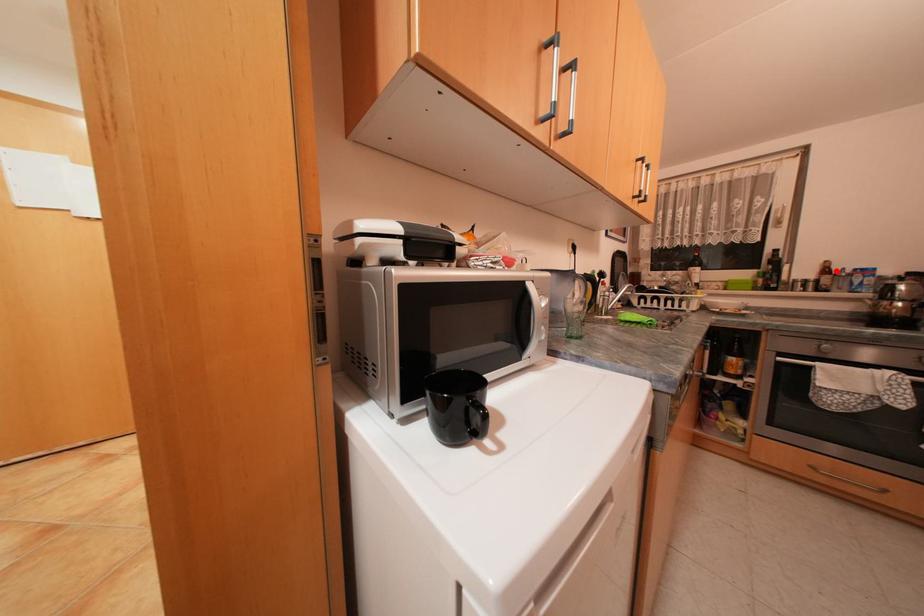
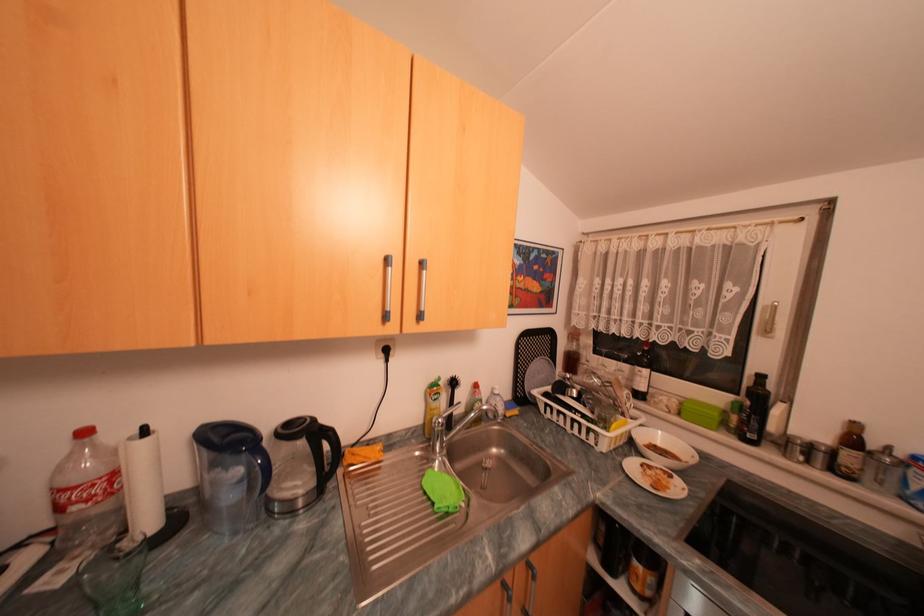
Locate, in the second image, the point that corresponds to the highlighted location in the first image.

(862, 440)